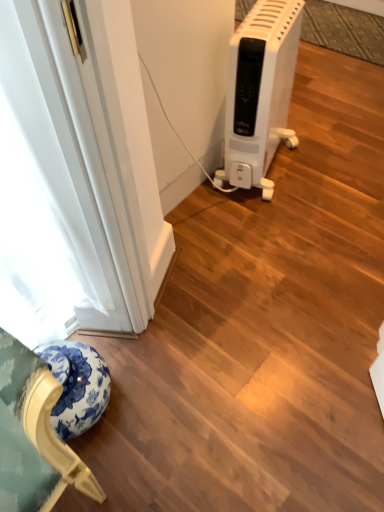
You are a GUI agent. You are given a task and a screenshot of the screen. Output one action in this format:
    pyautogui.click(x=<x>, y=<y>)
    Task: Click on the empty space that is ontop of blue and white ceramic swivel chair at lower left (from a real-world perspective)
    
    Given the screenshot: What is the action you would take?
    pyautogui.click(x=61, y=361)